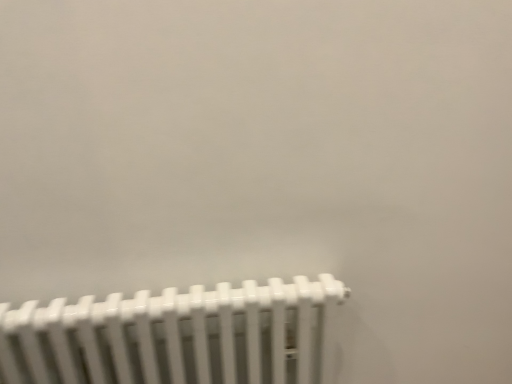
This screenshot has width=512, height=384. What are the coordinates of `white glossy radiator at lower left` in the screenshot? It's located at [178, 336].

Describe the element at coordinates (178, 336) in the screenshot. The width and height of the screenshot is (512, 384). I see `white glossy radiator at lower left` at that location.

Identify the location of white glossy radiator at lower left. Image resolution: width=512 pixels, height=384 pixels. (178, 336).